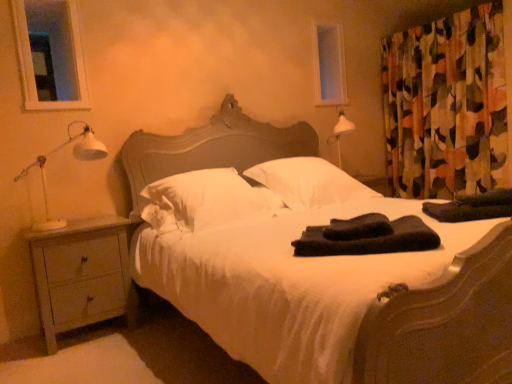
Locate an element on the screen. This screenshot has width=512, height=384. vacant region under white matte table lamp at left (from a real-world perspective) is located at coordinates (82, 226).